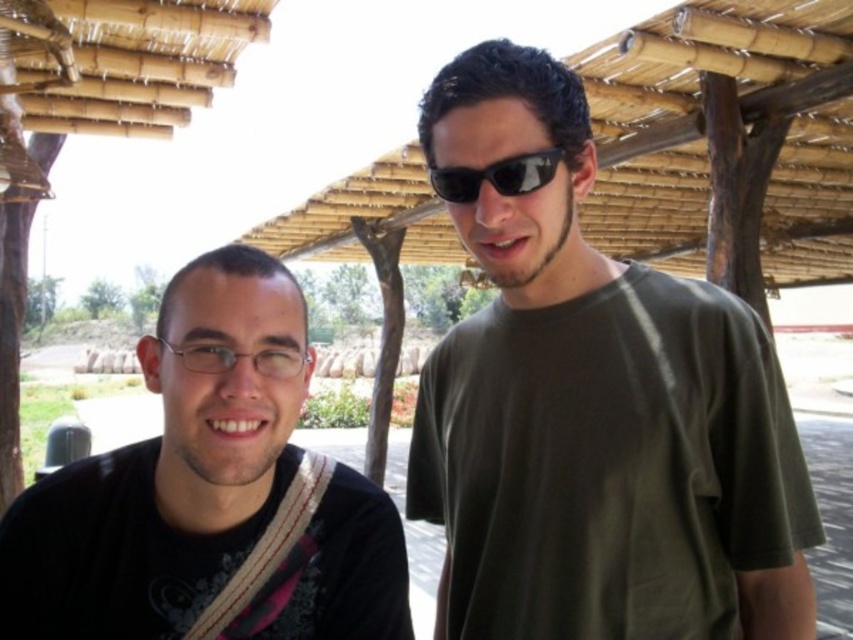
Question: Estimate the real-world distances between objects in this image. Which object is farther from the sunglasses at center?

Choices:
 (A) black matte shirt at left
 (B) green matte t-shirt at center

Answer: (A)

Question: Does green matte t-shirt at center have a larger size compared to black matte shirt at left?

Choices:
 (A) no
 (B) yes

Answer: (B)

Question: Observing the image, what is the correct spatial positioning of green matte t-shirt at center in reference to black matte shirt at left?

Choices:
 (A) below
 (B) above

Answer: (B)

Question: Does black matte shirt at left come behind sunglasses at center?

Choices:
 (A) no
 (B) yes

Answer: (A)

Question: Which of the following is the farthest from the observer?

Choices:
 (A) (485, 516)
 (B) (209, 378)
 (C) (469, 193)

Answer: (A)

Question: Estimate the real-world distances between objects in this image. Which object is farther from the black matte shirt at left?

Choices:
 (A) sunglasses at center
 (B) green matte t-shirt at center

Answer: (A)